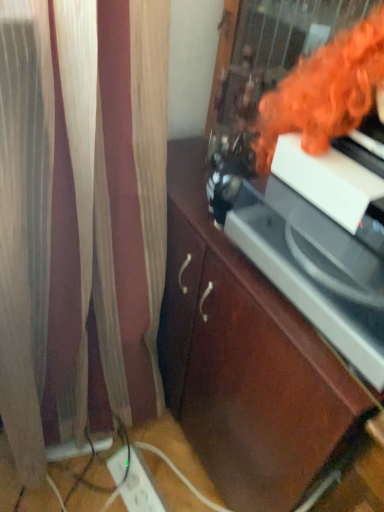
Question: Considering the relative sizes of brown wood cabinet at center and white plastic extension cord at lower left in the image provided, is brown wood cabinet at center smaller than white plastic extension cord at lower left?

Choices:
 (A) no
 (B) yes

Answer: (A)

Question: Is brown wood cabinet at center at the left side of white plastic extension cord at lower left?

Choices:
 (A) yes
 (B) no

Answer: (B)

Question: From the image's perspective, is brown wood cabinet at center under white plastic extension cord at lower left?

Choices:
 (A) no
 (B) yes

Answer: (A)

Question: From a real-world perspective, does brown wood cabinet at center sit lower than white plastic extension cord at lower left?

Choices:
 (A) no
 (B) yes

Answer: (A)

Question: Is brown wood cabinet at center next to white plastic extension cord at lower left?

Choices:
 (A) no
 (B) yes

Answer: (A)

Question: From a real-world perspective, is orange fabric at upper right physically located above or below white plastic extension cord at lower left?

Choices:
 (A) above
 (B) below

Answer: (A)

Question: Is orange fabric at upper right wider or thinner than white plastic extension cord at lower left?

Choices:
 (A) wide
 (B) thin

Answer: (A)

Question: From the image's perspective, is orange fabric at upper right located above or below white plastic extension cord at lower left?

Choices:
 (A) above
 (B) below

Answer: (A)

Question: Is orange fabric at upper right in front of or behind white plastic extension cord at lower left in the image?

Choices:
 (A) front
 (B) behind

Answer: (A)

Question: Do you think white plastic extension cord at lower left is within orange fabric at upper right, or outside of it?

Choices:
 (A) outside
 (B) inside

Answer: (A)

Question: From the image's perspective, is white plastic extension cord at lower left positioned above or below orange fabric at upper right?

Choices:
 (A) below
 (B) above

Answer: (A)

Question: Relative to orange fabric at upper right, is white plastic extension cord at lower left in front or behind?

Choices:
 (A) behind
 (B) front

Answer: (A)

Question: Is white plastic extension cord at lower left bigger or smaller than orange fabric at upper right?

Choices:
 (A) big
 (B) small

Answer: (B)

Question: Considering the positions of white plastic extension cord at lower left and brown wood cabinet at center in the image, is white plastic extension cord at lower left wider or thinner than brown wood cabinet at center?

Choices:
 (A) thin
 (B) wide

Answer: (A)

Question: In the image, is white plastic extension cord at lower left positioned in front of or behind brown wood cabinet at center?

Choices:
 (A) behind
 (B) front

Answer: (A)